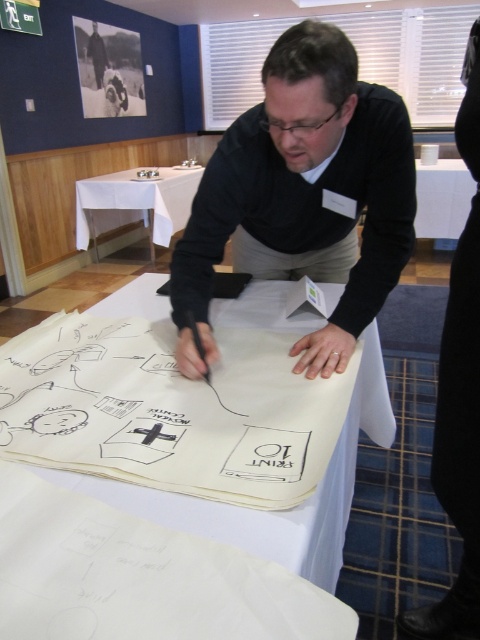
Question: Which point is closer to the camera?

Choices:
 (A) black matte sweater at center
 (B) white paper at center

Answer: (B)

Question: Can you confirm if white paper at center is smaller than white cloth at upper left?

Choices:
 (A) yes
 (B) no

Answer: (A)

Question: Among these objects, which one is nearest to the camera?

Choices:
 (A) white cloth at upper left
 (B) white paper at center
 (C) black matte sweater at center

Answer: (B)

Question: Which object is closer to the camera taking this photo?

Choices:
 (A) white cloth at upper left
 (B) black matte sweater at center
 (C) white paper at center

Answer: (C)

Question: Is black matte sweater at center to the left of white cloth at upper left from the viewer's perspective?

Choices:
 (A) no
 (B) yes

Answer: (A)

Question: Can you confirm if white paper at center is smaller than white cloth at upper left?

Choices:
 (A) no
 (B) yes

Answer: (B)